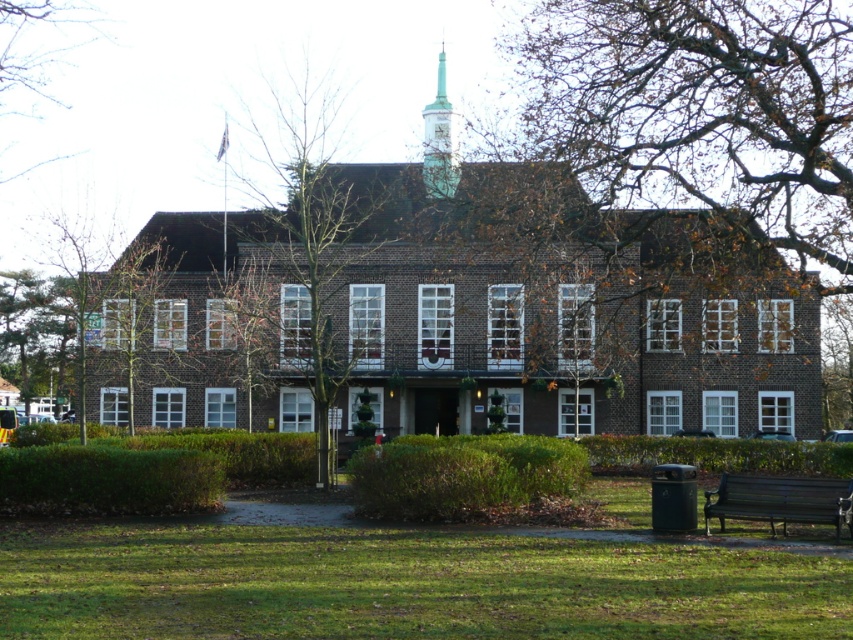
Who is taller, green leafy hedge at lower left or brown leafy tree at center?

brown leafy tree at center is taller.

From the picture: Which is above, green leafy hedge at lower left or brown leafy tree at center?

brown leafy tree at center is above.

Describe the element at coordinates (107, 481) in the screenshot. This screenshot has height=640, width=853. I see `green leafy hedge at lower left` at that location.

You are a GUI agent. You are given a task and a screenshot of the screen. Output one action in this format:
    pyautogui.click(x=<x>, y=<y>)
    Task: Click on the green leafy hedge at lower left
    This screenshot has width=853, height=640.
    Given the screenshot: What is the action you would take?
    pyautogui.click(x=107, y=481)

Is bare wood tree at center wider than green leafy hedge at lower left?

Yes.

From the picture: Which is below, bare wood tree at center or green leafy hedge at lower left?

green leafy hedge at lower left

This screenshot has width=853, height=640. Identify the location of bare wood tree at center. (326, 260).

Where is `brown brick church at center`? This screenshot has width=853, height=640. brown brick church at center is located at coordinates pos(469,310).

Looking at this image, does brown brick church at center appear over dark brown wooden bench at lower right?

Indeed, brown brick church at center is positioned over dark brown wooden bench at lower right.

Describe the element at coordinates (469, 310) in the screenshot. I see `brown brick church at center` at that location.

Identify the location of brown brick church at center. (469, 310).